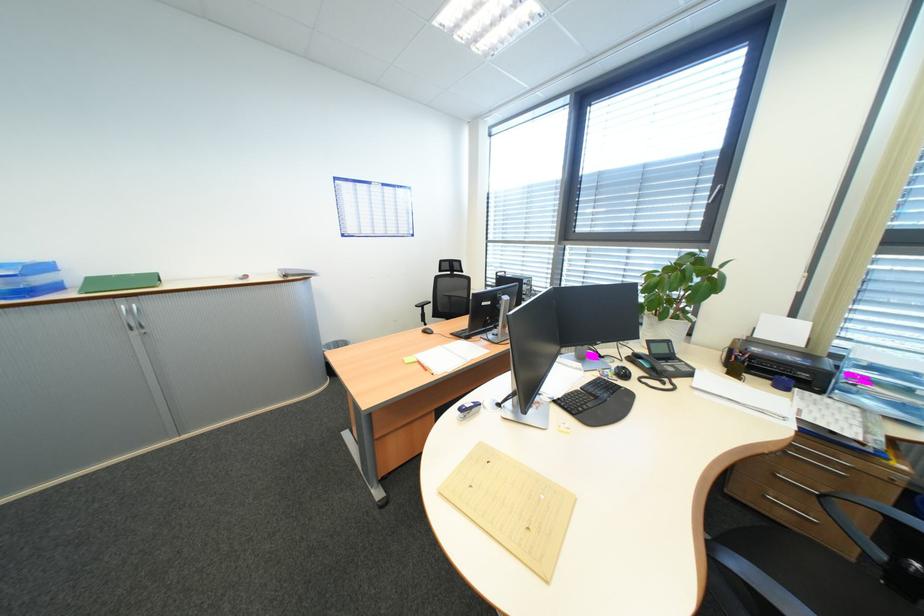
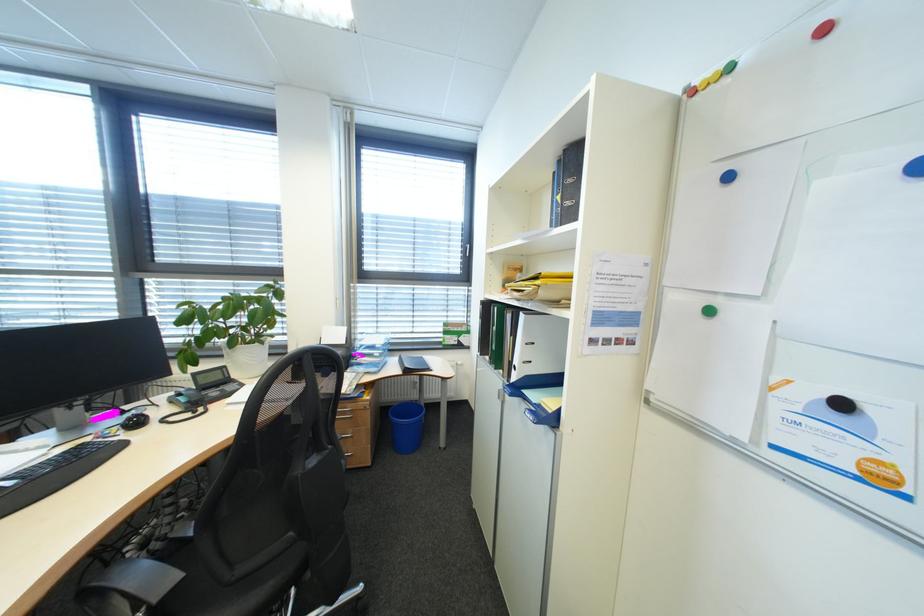
Question: Based on the continuous images, in which direction is the camera rotating? Reply with the corresponding letter.

Choices:
 (A) Left
 (B) Right
 (C) Up
 (D) Down

Answer: (B)